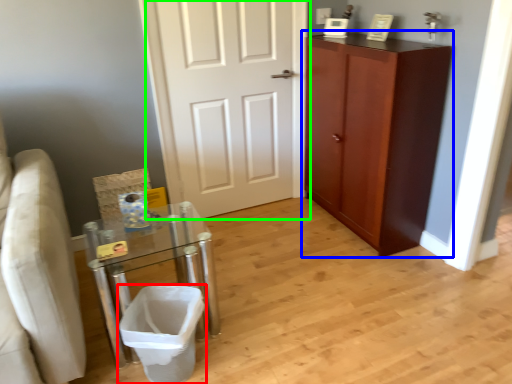
Question: Estimate the real-world distances between objects in this image. Which object is closer to laundry basket (highlighted by a red box), cabinetry (highlighted by a blue box) or door (highlighted by a green box)?

Choices:
 (A) cabinetry
 (B) door

Answer: (B)